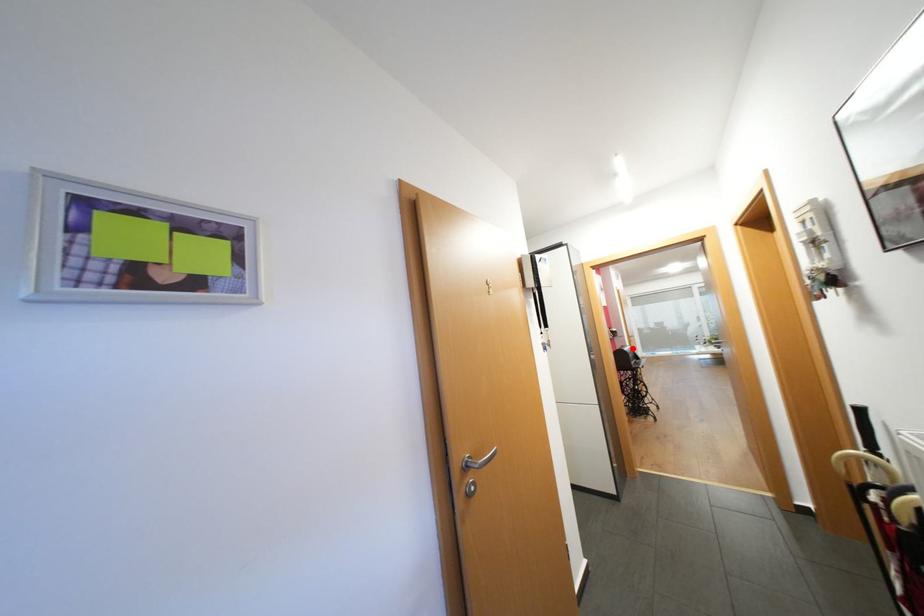
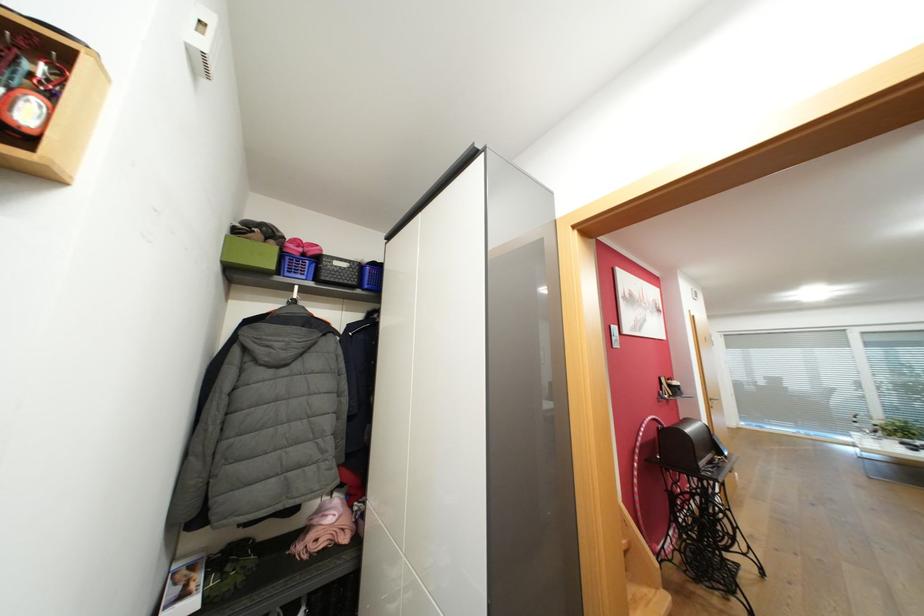
Question: A red point is marked in image1. In image2, is the corresponding 3D point closer to the camera or farther? Reply with the corresponding letter.

Choices:
 (A) The corresponding 3D point is closer.
 (B) The corresponding 3D point is farther.

Answer: (A)